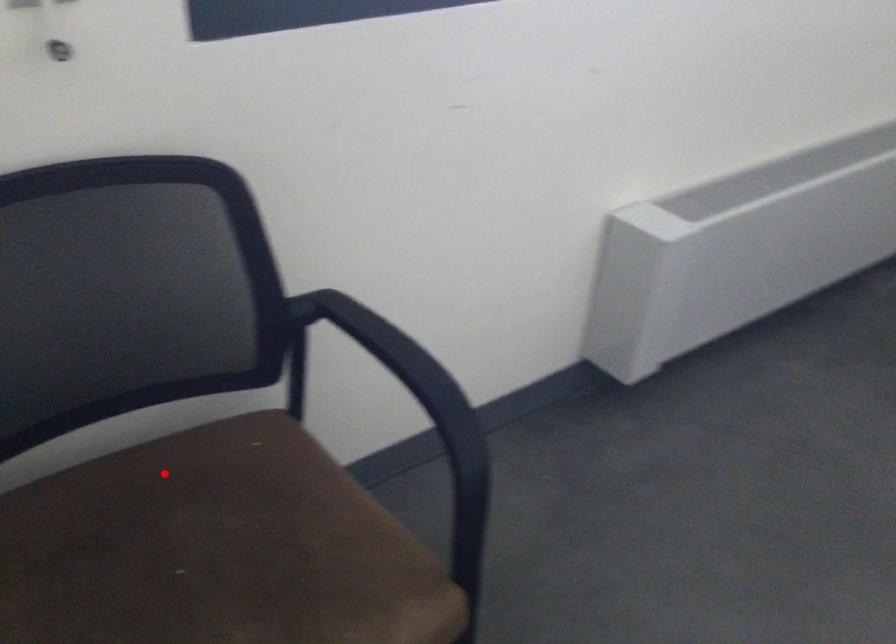
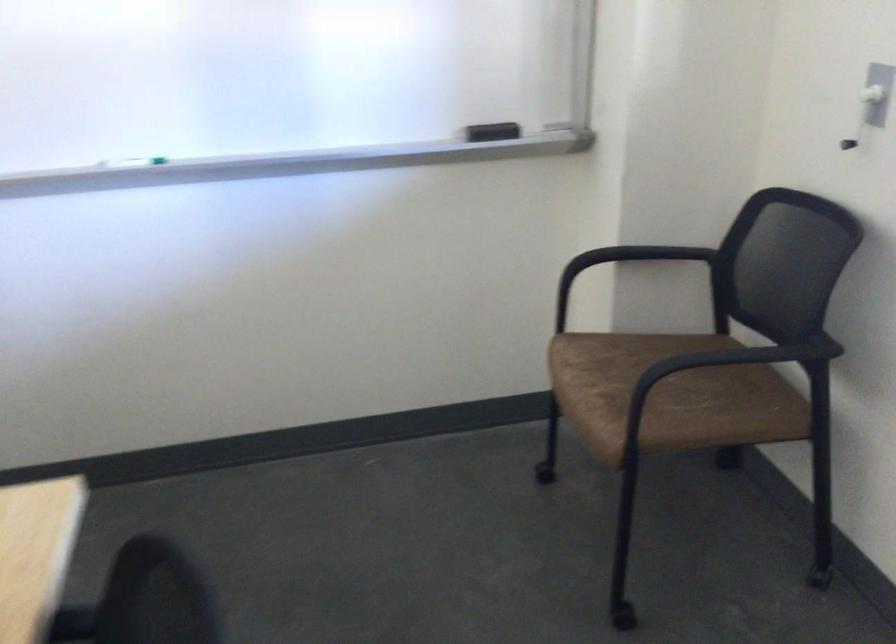
Locate, in the second image, the point that corresponds to the highlighted location in the first image.

(745, 381)